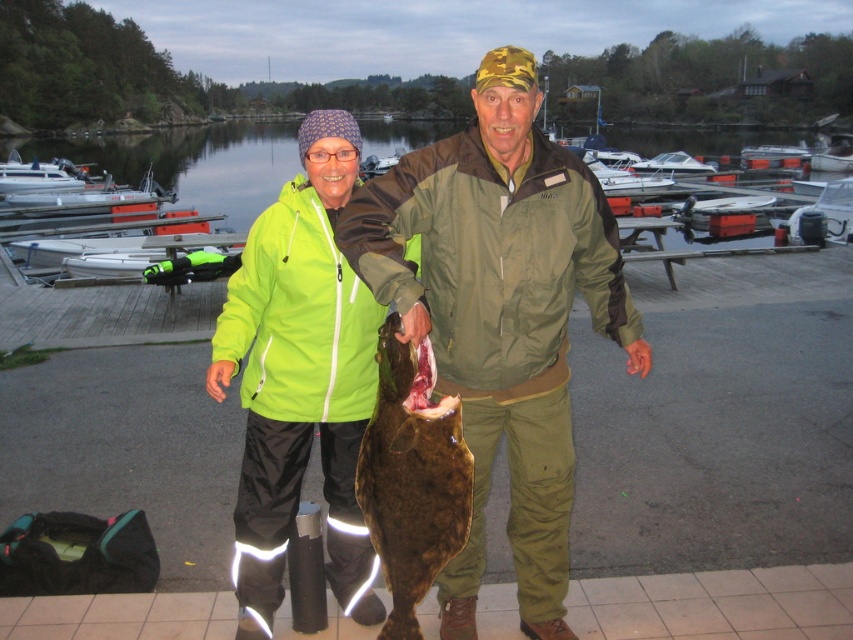
You are standing at the point with coordinates point (397, 131) and want to walk towards the point with coordinates point (643, 166). Which direction should you move in relation to the scene?

You should move away from the viewer since point (397, 131) is closer to the viewer than point (643, 166).